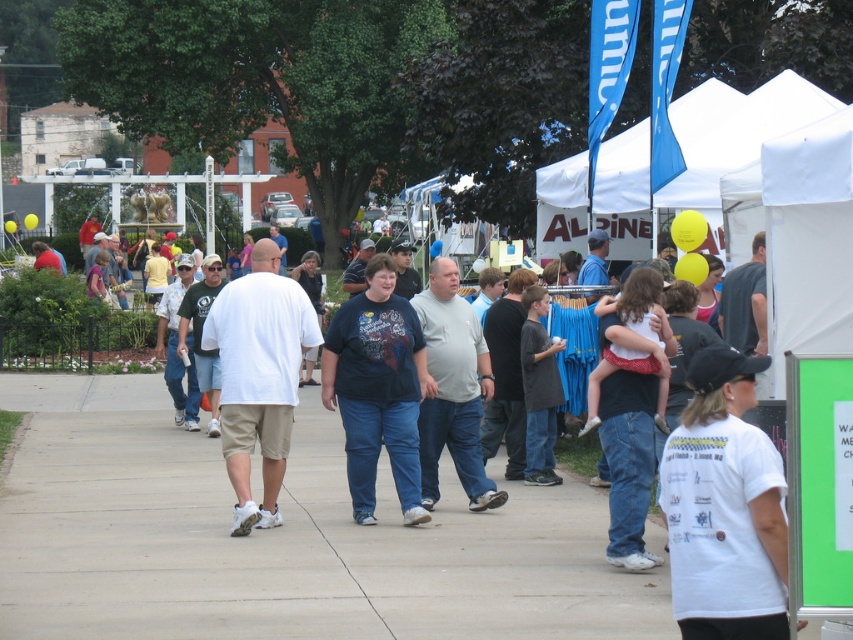
Question: Which point appears closest to the camera in this image?

Choices:
 (A) (300, 332)
 (B) (547, 380)
 (C) (486, 488)
 (D) (686, 554)

Answer: (D)

Question: Does dark blue t-shirt at center have a greater width compared to light gray cotton shirt at center?

Choices:
 (A) yes
 (B) no

Answer: (A)

Question: Which of these objects is positioned closest to the white cotton shirt at center?

Choices:
 (A) matte black shirt at center
 (B) white t-shirt at lower right
 (C) light gray cotton shirt at center
 (D) dark blue t-shirt at center

Answer: (D)

Question: Does dark blue t-shirt at center appear over light gray cotton shirt at center?

Choices:
 (A) no
 (B) yes

Answer: (A)

Question: Is white t-shirt at lower right wider than matte black shirt at center?

Choices:
 (A) yes
 (B) no

Answer: (B)

Question: Which of the following is the closest to the observer?

Choices:
 (A) white cotton shirt at center
 (B) dark gray cotton shirt at center
 (C) matte black shirt at center
 (D) dark blue t-shirt at center

Answer: (C)